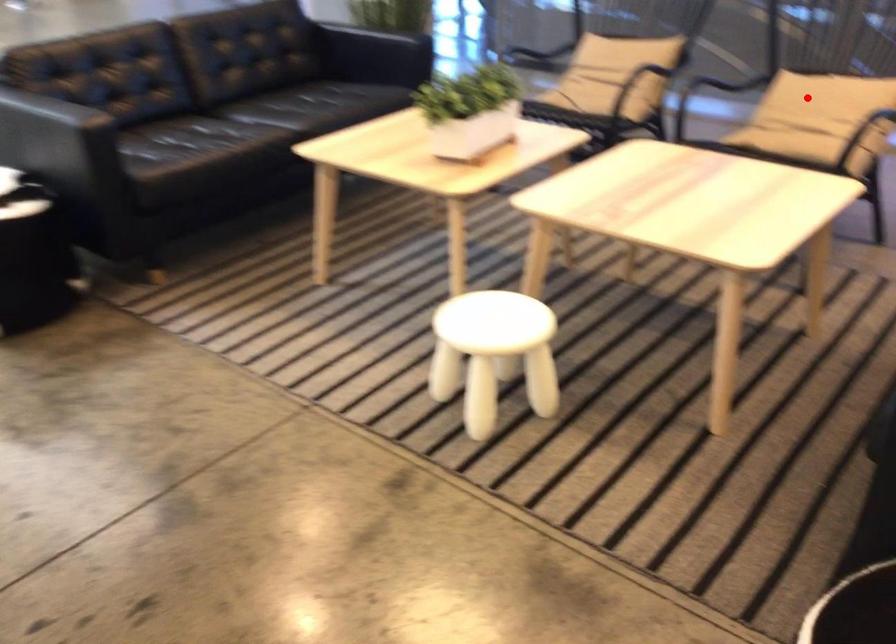
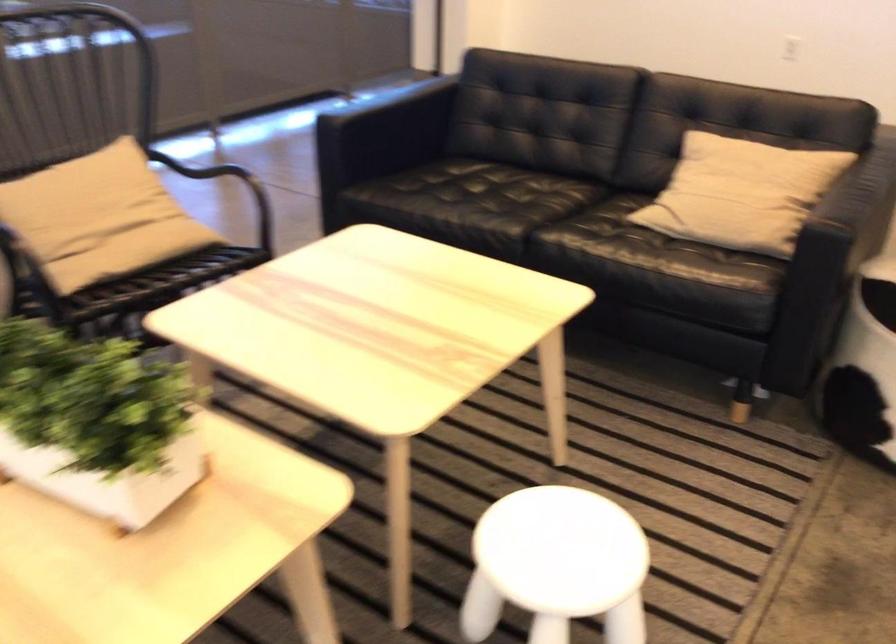
Find the pixel in the second image that matches the highlighted location in the first image.

(99, 214)